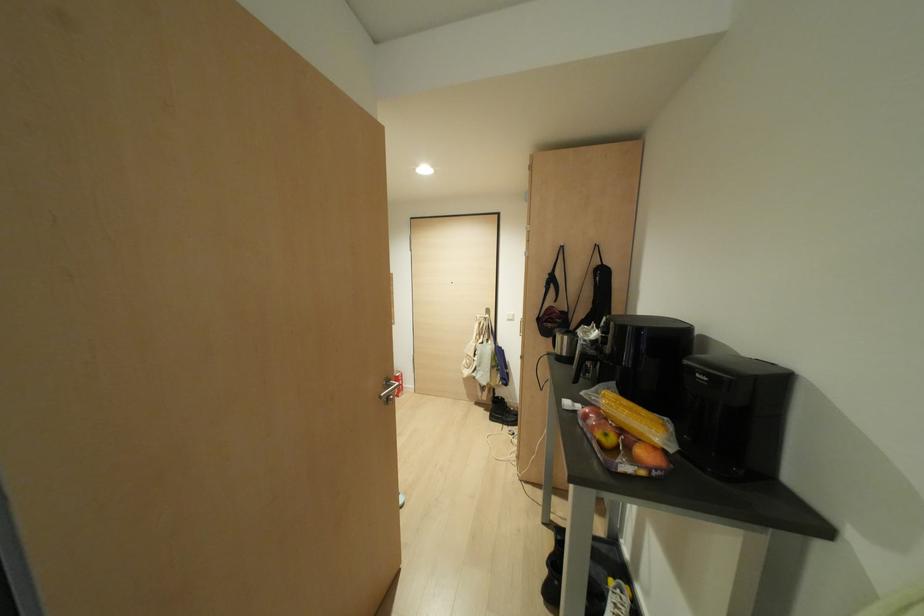
Find where to lift the black boot. Please return your answer as a coordinate pair (x, y).

(588, 573)